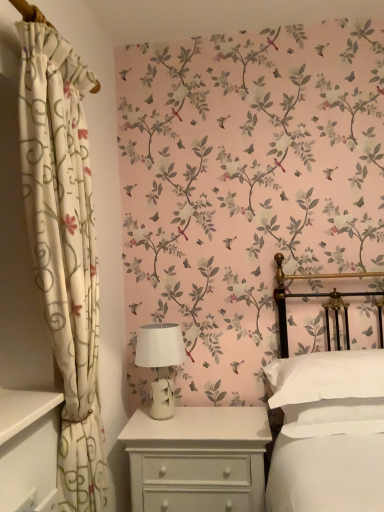
Question: From a real-world perspective, is white soft pillow at right located beneath white painted wood nightstand at lower center?

Choices:
 (A) yes
 (B) no

Answer: (B)

Question: Is white soft pillow at right closer to camera compared to white painted wood nightstand at lower center?

Choices:
 (A) no
 (B) yes

Answer: (B)

Question: From the image's perspective, is white soft pillow at right on top of white painted wood nightstand at lower center?

Choices:
 (A) yes
 (B) no

Answer: (A)

Question: Is white soft pillow at right thinner than white painted wood nightstand at lower center?

Choices:
 (A) no
 (B) yes

Answer: (A)

Question: Does white soft pillow at right have a smaller size compared to white painted wood nightstand at lower center?

Choices:
 (A) no
 (B) yes

Answer: (B)

Question: Can you confirm if white soft pillow at right is bigger than white painted wood nightstand at lower center?

Choices:
 (A) no
 (B) yes

Answer: (A)

Question: Would you say white ceramic table lamp at center is part of white floral fabric curtain at left's contents?

Choices:
 (A) no
 (B) yes

Answer: (A)

Question: Is the position of white floral fabric curtain at left less distant than that of white ceramic table lamp at center?

Choices:
 (A) yes
 (B) no

Answer: (A)

Question: Is white floral fabric curtain at left looking in the opposite direction of white ceramic table lamp at center?

Choices:
 (A) no
 (B) yes

Answer: (A)

Question: From the image's perspective, is white floral fabric curtain at left over white ceramic table lamp at center?

Choices:
 (A) yes
 (B) no

Answer: (A)

Question: Is white floral fabric curtain at left shorter than white ceramic table lamp at center?

Choices:
 (A) yes
 (B) no

Answer: (B)

Question: Is white floral fabric curtain at left wider than white ceramic table lamp at center?

Choices:
 (A) yes
 (B) no

Answer: (B)

Question: Is white ceramic table lamp at center at the back of white soft pillow at right?

Choices:
 (A) no
 (B) yes

Answer: (A)